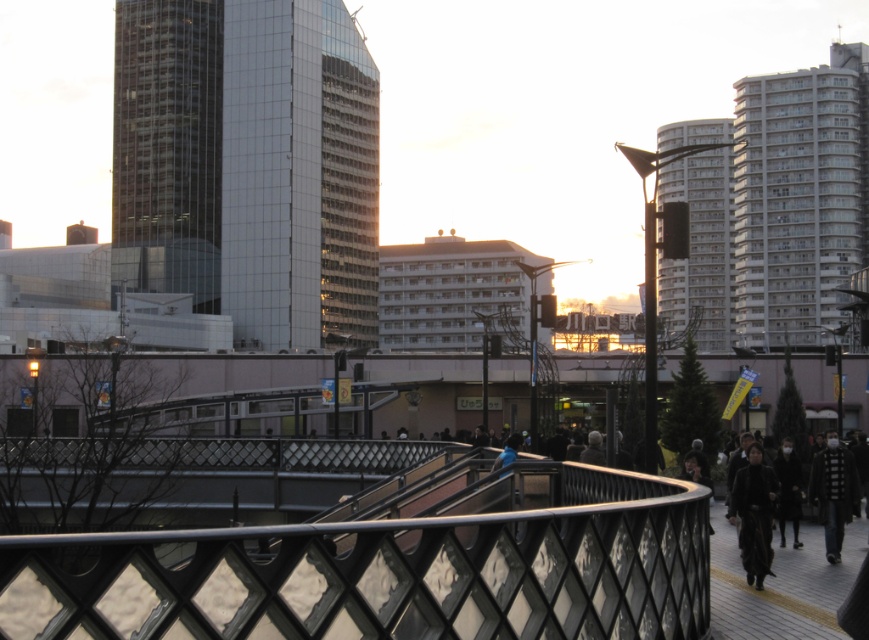
You are a fashion designer observing an urban scene. You notice a black fur coat at lower right and a blue fabric at center. Which object is positioned to the right of the other?

The black fur coat at lower right is to the right of the blue fabric at center.

Looking at this image, you are a photographer trying to capture a shot of the urban scene. You notice the black textured jacket at lower right and the blue fabric at center. Which object should you focus on to ensure it doesn not get cropped out of the frame if your camera has a limited field of view?

The blue fabric at center is narrower than the black textured jacket at lower right, so focusing on the blue fabric at center would be less likely to get cropped out if the camera has a limited field of view.

You are a fashion designer observing an urban scene. You notice a black fur coat at lower right and a blue fabric at center. Which item has a greater thickness?

The blue fabric at center is thicker than the black fur coat at lower right.